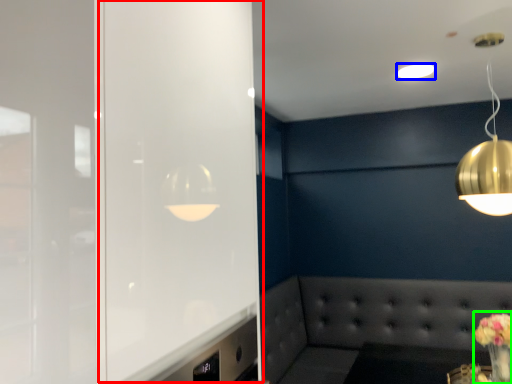
Question: Considering the real-world distances, which object is farthest from glass door (highlighted by a red box)? lamp (highlighted by a blue box) or floral arrangement (highlighted by a green box)?

Choices:
 (A) lamp
 (B) floral arrangement

Answer: (A)